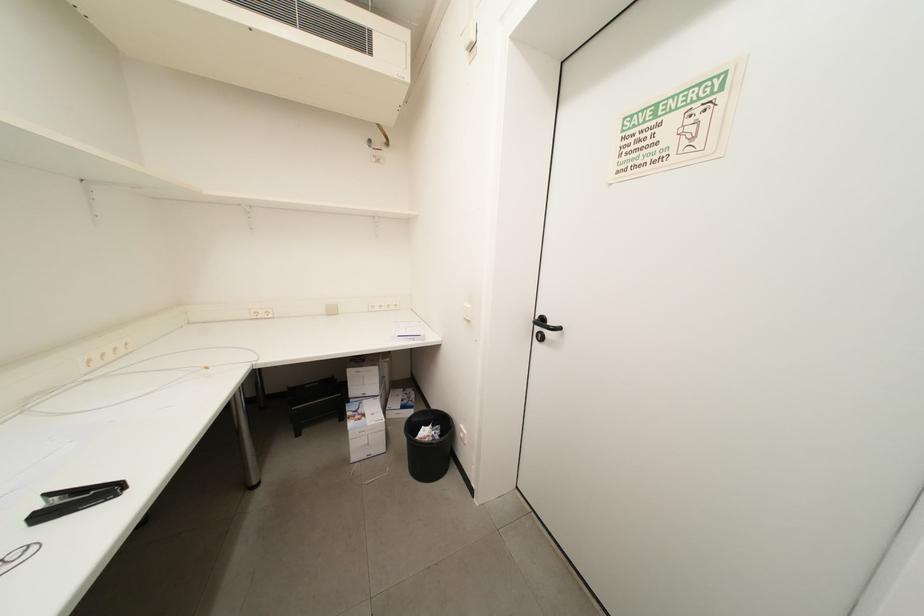
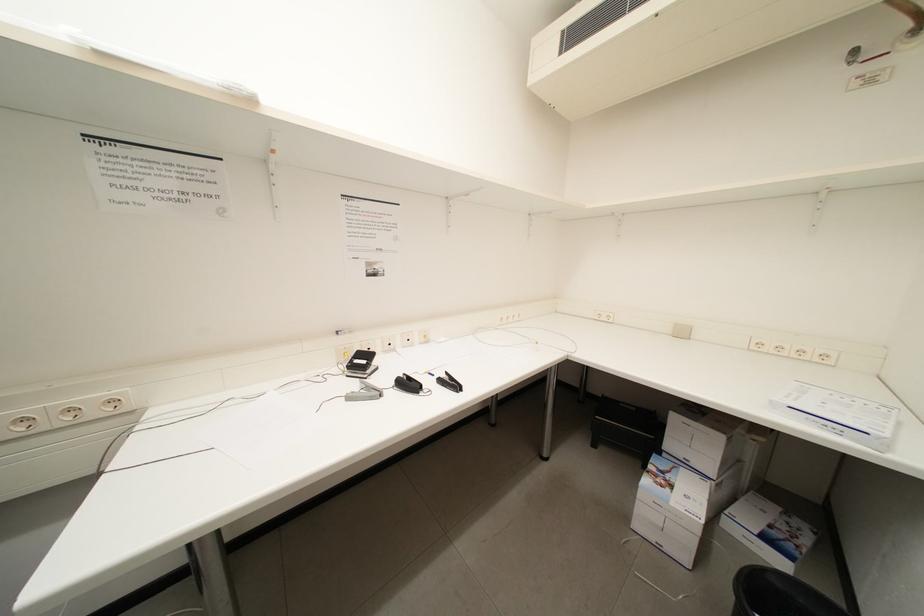
Question: The camera is either moving clockwise (left) or counter-clockwise (right) around the object. The first image is from the beginning of the video and the second image is from the end. Is the camera moving left or right when shooting the video?

Choices:
 (A) Left
 (B) Right

Answer: (B)